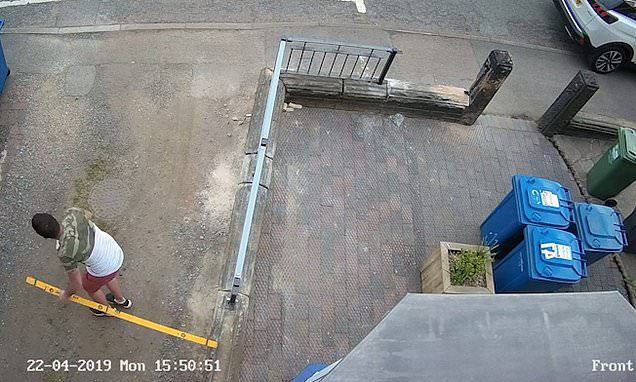
Identify the location of wooden planter. (437, 278).